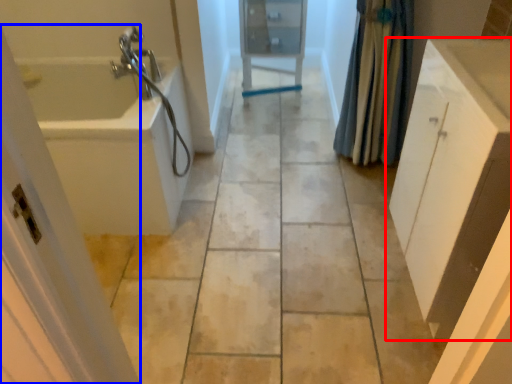
Question: Which object is further to the camera taking this photo, bathroom cabinet (highlighted by a red box) or screen door (highlighted by a blue box)?

Choices:
 (A) bathroom cabinet
 (B) screen door

Answer: (A)